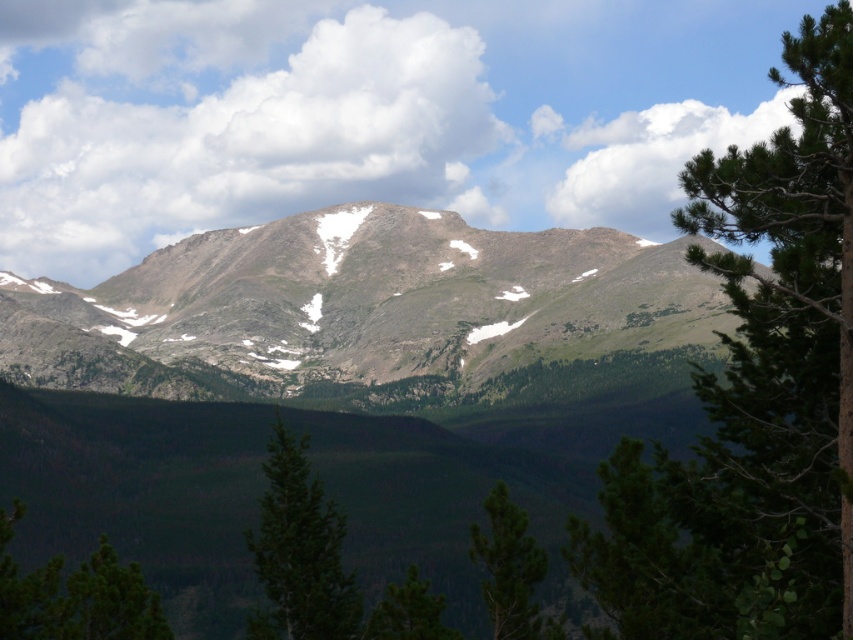
Image resolution: width=853 pixels, height=640 pixels. What do you see at coordinates (753, 397) in the screenshot?
I see `green leafy tree at right` at bounding box center [753, 397].

Which is behind, point (753, 186) or point (283, 524)?

Point (283, 524)

Which is behind, point (624, 458) or point (299, 531)?

Point (299, 531)

Where is `green leafy tree at right`? This screenshot has width=853, height=640. green leafy tree at right is located at coordinates (753, 397).

Consider the image. Is brown rocky mountain at center wider than green matte tree at lower center?

Correct, the width of brown rocky mountain at center exceeds that of green matte tree at lower center.

This screenshot has height=640, width=853. I want to click on brown rocky mountain at center, so click(x=358, y=305).

Is brown rocky mountain at center positioned before green matte tree at center?

No, it is not.

Which of these two, brown rocky mountain at center or green matte tree at center, stands taller?

With more height is brown rocky mountain at center.

This screenshot has height=640, width=853. What are the coordinates of `brown rocky mountain at center` in the screenshot? It's located at (358, 305).